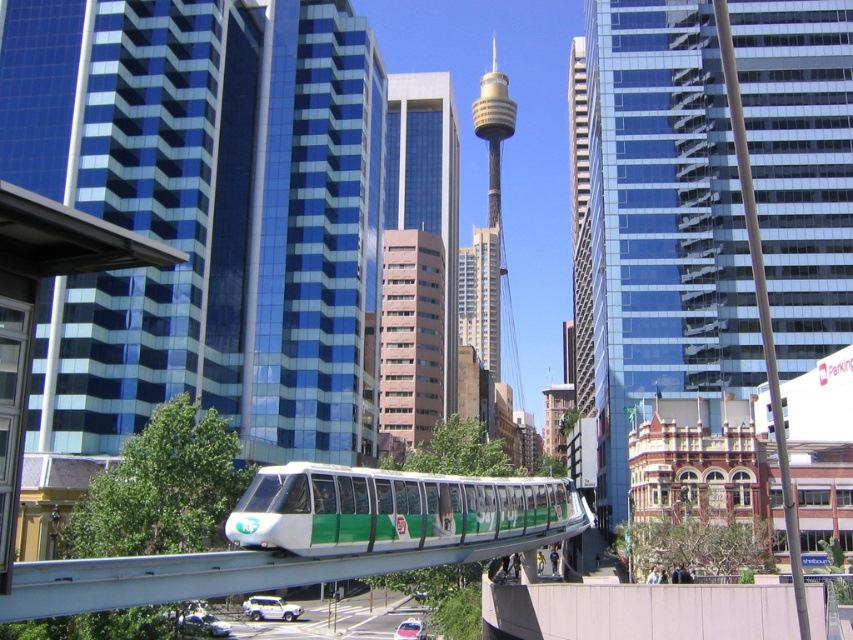
Is the position of green matte monorail at center less distant than that of pink smooth building at center?

Yes, it is in front of pink smooth building at center.

Measure the distance between green matte monorail at center and camera.

green matte monorail at center and camera are 41.22 meters apart.

Locate an element on the screen. green matte monorail at center is located at coordinates (392, 509).

Is glassy blue skyscraper at center taller than pink smooth building at center?

Yes.

Can you confirm if glassy blue skyscraper at center is bigger than pink smooth building at center?

Indeed, glassy blue skyscraper at center has a larger size compared to pink smooth building at center.

Which is behind, point (670, 390) or point (398, 340)?

Positioned behind is point (398, 340).

Locate an element on the screen. This screenshot has width=853, height=640. glassy blue skyscraper at center is located at coordinates tap(654, 225).

Does pink glass tower at center have a lesser height compared to pink smooth building at center?

Incorrect, pink glass tower at center's height does not fall short of pink smooth building at center's.

Who is taller, pink glass tower at center or pink smooth building at center?

pink glass tower at center

I want to click on pink glass tower at center, so click(419, 257).